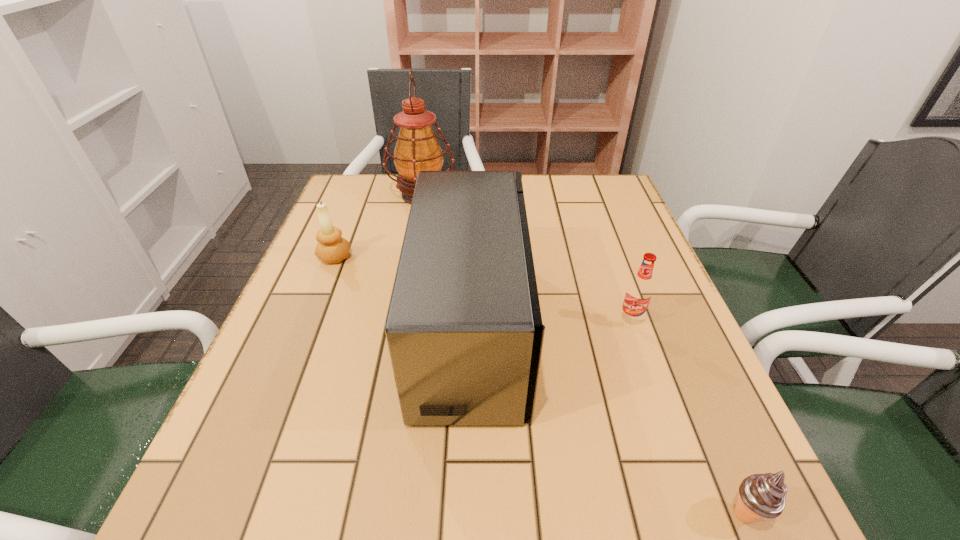
Locate an element on the screen. the tallest object is located at coordinates (417, 149).

This screenshot has width=960, height=540. Identify the location of oil lamp. (417, 149).

I want to click on microwave_oven, so click(464, 330).

Image resolution: width=960 pixels, height=540 pixels. I want to click on the second object from right to left, so tap(639, 291).

You are a GUI agent. You are given a task and a screenshot of the screen. Output one action in this format:
    pyautogui.click(x=<x>, y=<y>)
    Task: Click on the candle_holder
    
    Given the screenshot: What is the action you would take?
    pyautogui.click(x=331, y=248)

Locate an element on the screen. Image resolution: width=960 pixels, height=540 pixels. the rightmost object is located at coordinates (760, 495).

I want to click on icecream, so click(x=760, y=495).

I want to click on vacant position located 0.290m on the right of the oil lamp, so click(555, 195).

You are a GUI agent. You are given a task and a screenshot of the screen. Output one action in this format:
    pyautogui.click(x=<x>, y=<y>)
    Task: Click on the vacant point located on the front-facing side of the fourth shortest object
    Image resolution: width=960 pixels, height=540 pixels.
    Given the screenshot: What is the action you would take?
    pyautogui.click(x=635, y=329)

In order to click on blank area located on the left of the root beer in this screenshot , I will do `click(509, 320)`.